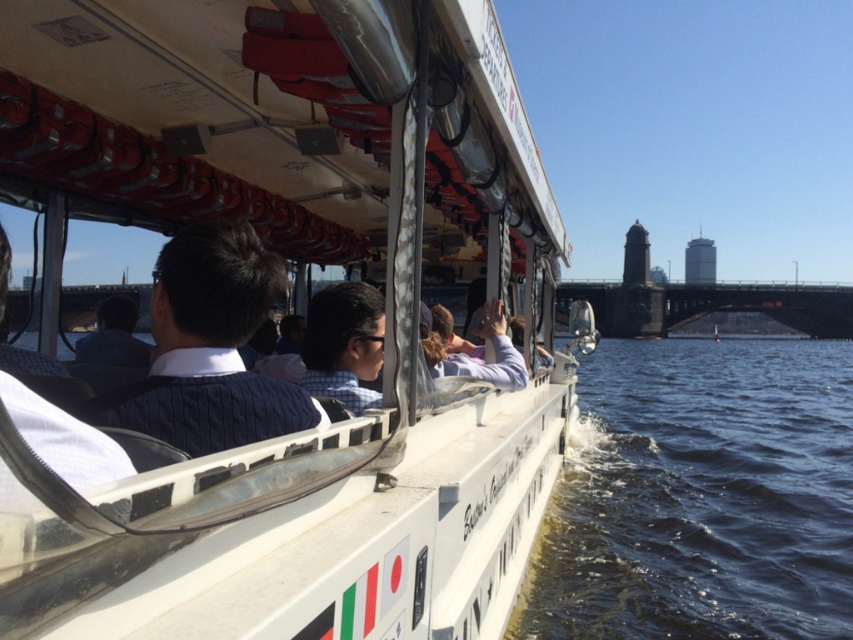
Question: Observing the image, what is the correct spatial positioning of white plastic boat at center in reference to navy blue sweater at center?

Choices:
 (A) above
 (B) below

Answer: (A)

Question: Which object is positioned farthest from the navy blue sweater at center?

Choices:
 (A) white plastic boat at center
 (B) checkered fabric shirt at center

Answer: (A)

Question: Which point is closer to the camera?

Choices:
 (A) (254, 237)
 (B) (311, 124)

Answer: (A)

Question: Considering the real-world distances, which object is closest to the white plastic boat at center?

Choices:
 (A) navy blue sweater at center
 (B) checkered fabric shirt at center

Answer: (B)

Question: Is white plastic boat at center wider than navy blue sweater at center?

Choices:
 (A) yes
 (B) no

Answer: (B)

Question: Can you confirm if white plastic boat at center is positioned below checkered fabric shirt at center?

Choices:
 (A) no
 (B) yes

Answer: (A)